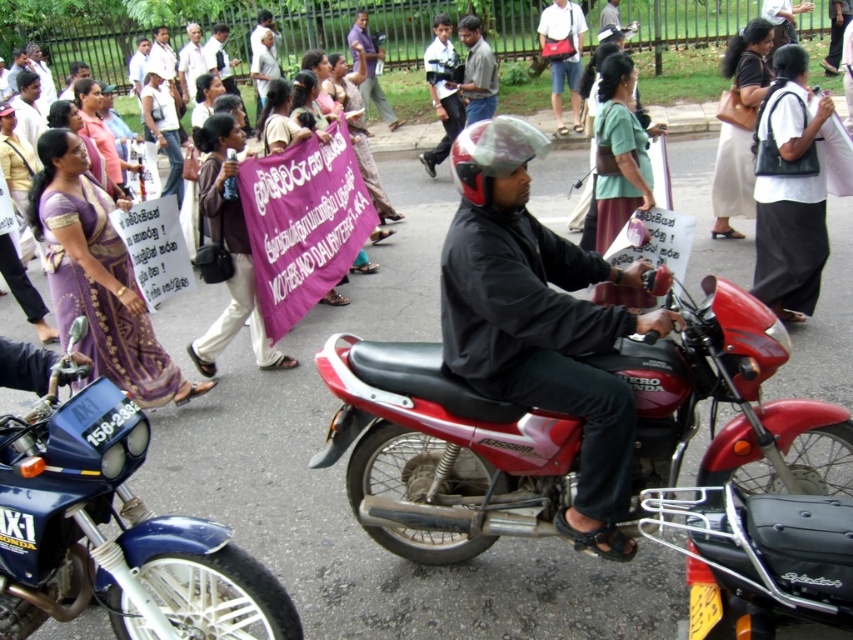
Question: Can you confirm if red matte motorcycle at center is positioned below blue metallic motorcycle at lower left?

Choices:
 (A) no
 (B) yes

Answer: (A)

Question: Is blue metallic motorcycle at lower left closer to the viewer compared to matte black helmet at center?

Choices:
 (A) yes
 (B) no

Answer: (A)

Question: Considering the relative positions of red matte motorcycle at center and blue metallic motorcycle at lower left in the image provided, where is red matte motorcycle at center located with respect to blue metallic motorcycle at lower left?

Choices:
 (A) left
 (B) right

Answer: (B)

Question: Which is farther from the red matte motorcycle at center?

Choices:
 (A) blue metallic motorcycle at lower left
 (B) matte black helmet at center

Answer: (A)

Question: Which of these objects is positioned farthest from the red matte motorcycle at center?

Choices:
 (A) blue metallic motorcycle at lower left
 (B) matte black helmet at center

Answer: (A)

Question: Which is farther from the blue metallic motorcycle at lower left?

Choices:
 (A) matte black helmet at center
 (B) red matte motorcycle at center

Answer: (A)